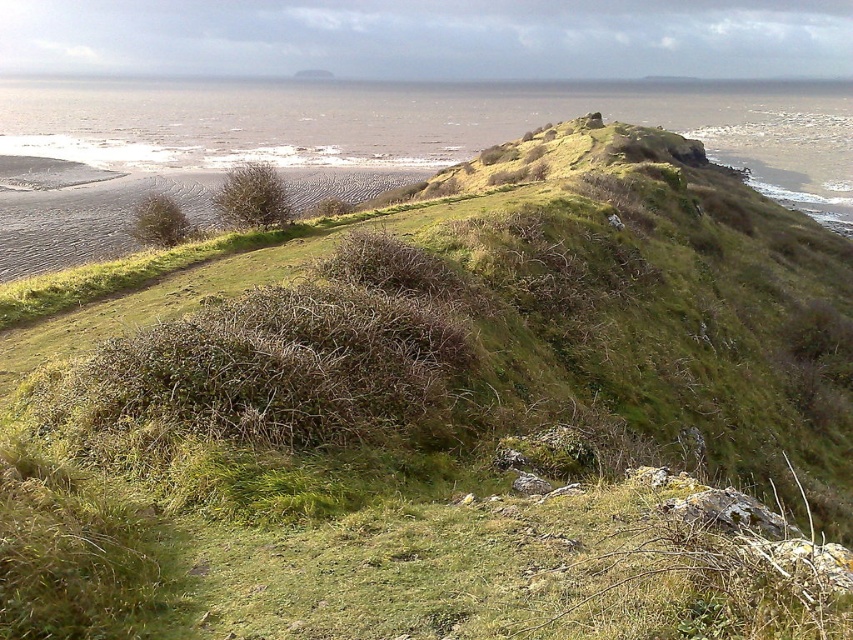
Question: Does green leafy bush at center appear on the left side of green grassy bush at lower left?

Choices:
 (A) no
 (B) yes

Answer: (A)

Question: Which of the following is the farthest from the observer?

Choices:
 (A) green grassy bush at lower left
 (B) green leafy bush at center

Answer: (A)

Question: Is green leafy bush at center below green grassy bush at lower left?

Choices:
 (A) yes
 (B) no

Answer: (B)

Question: Considering the relative positions of green leafy bush at center and green grassy bush at lower left in the image provided, where is green leafy bush at center located with respect to green grassy bush at lower left?

Choices:
 (A) right
 (B) left

Answer: (A)